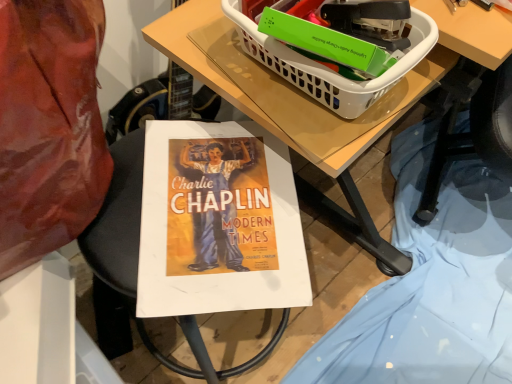
Where is `vacant point above wooden table at center (from a real-world perspective)`? This screenshot has width=512, height=384. vacant point above wooden table at center (from a real-world perspective) is located at coordinates (381, 260).